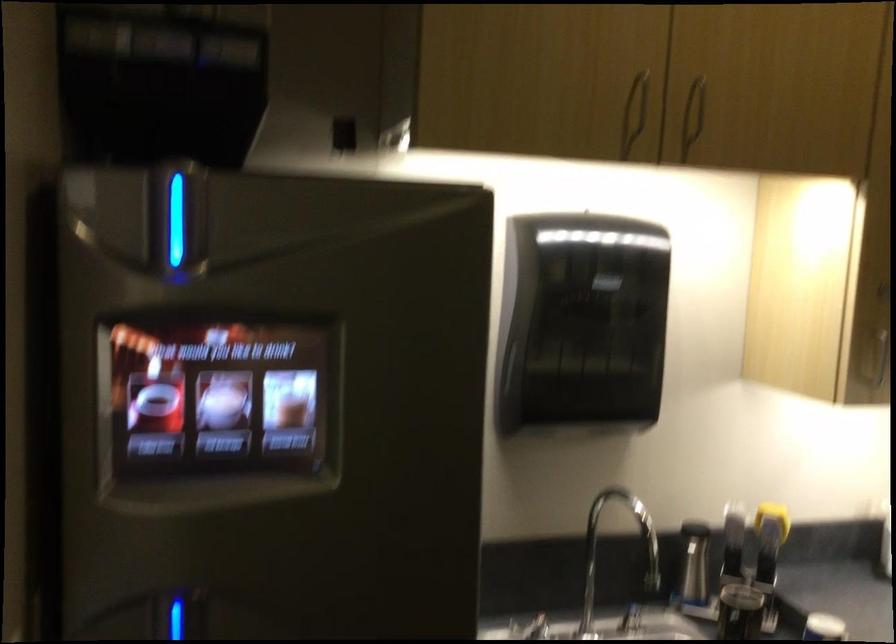
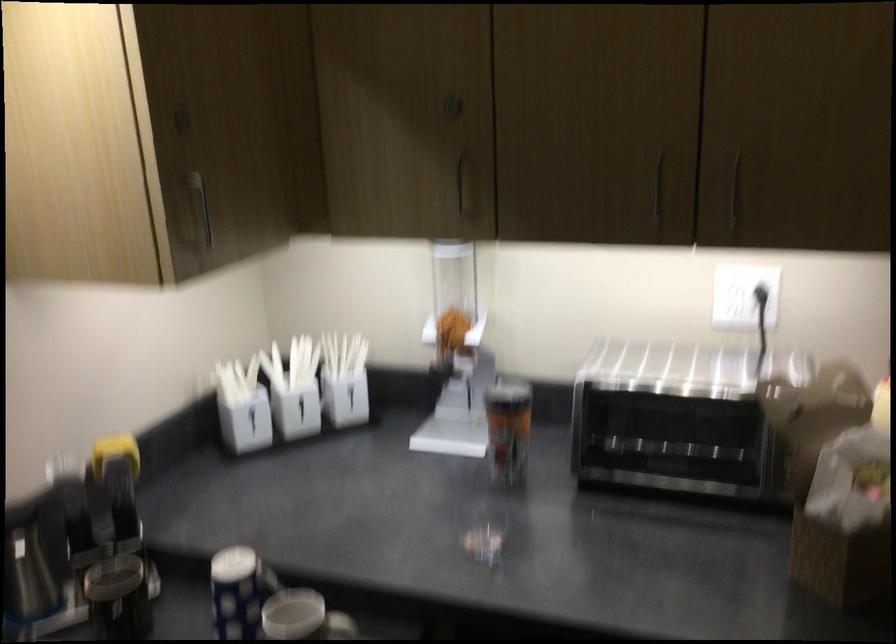
Question: The first image is from the beginning of the video and the second image is from the end. How did the camera likely rotate when shooting the video?

Choices:
 (A) Left
 (B) Right
 (C) Up
 (D) Down

Answer: (B)